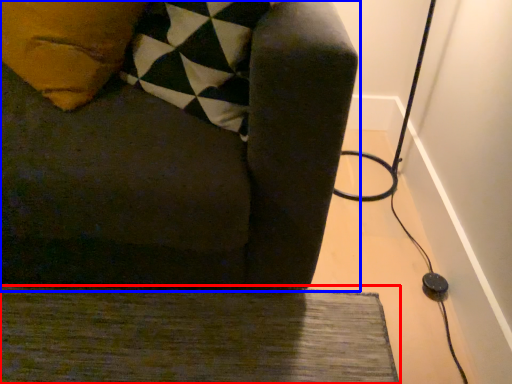
Question: Which point is closer to the camera, doormat (highlighted by a red box) or furniture (highlighted by a blue box)?

Choices:
 (A) doormat
 (B) furniture

Answer: (B)